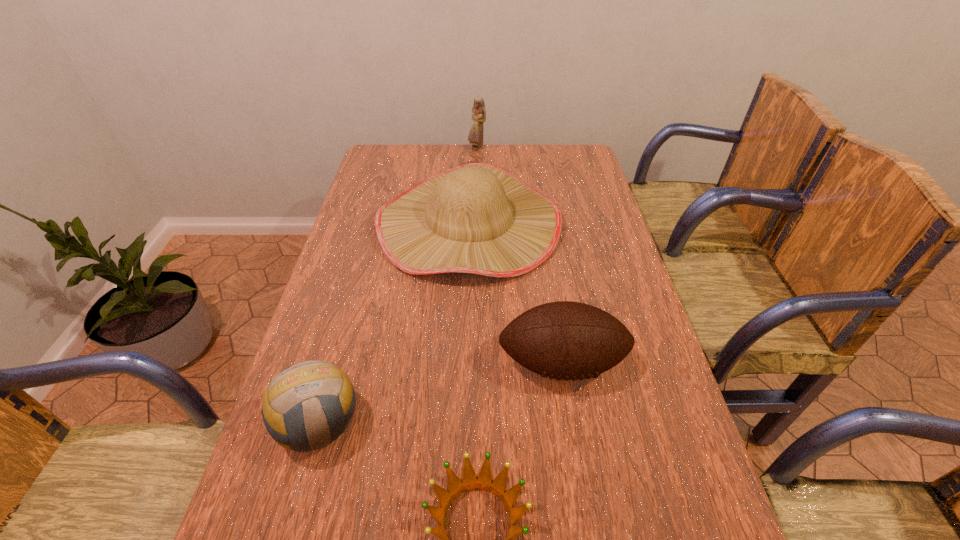
Identify the location of figurine. This screenshot has height=540, width=960. (475, 137).

What are the coordinates of `sunhat` in the screenshot? It's located at (479, 218).

Identify the location of football. (564, 340).

Find the location of `volleyball`. volleyball is located at coordinates (292, 413).

Locate an element on the screen. Image resolution: width=960 pixels, height=540 pixels. free space located on the front-facing side of the farthest object is located at coordinates pos(477,167).

Locate an element on the screen. This screenshot has width=960, height=540. vacant space located 0.060m on the back of the sunhat is located at coordinates (470, 167).

The width and height of the screenshot is (960, 540). Find the location of `free space located on the laces of the football`. free space located on the laces of the football is located at coordinates (572, 431).

You are a GUI agent. You are given a task and a screenshot of the screen. Output one action in this format:
    pyautogui.click(x=<x>, y=<y>)
    Task: Click on the blank space located on the right of the volleyball
    
    Given the screenshot: What is the action you would take?
    (444, 424)

You are a GUI agent. You are given a task and a screenshot of the screen. Output one action in this format:
    pyautogui.click(x=<x>, y=<y>)
    Task: Click on the figurine at the far edge
    This screenshot has height=540, width=960.
    Given the screenshot: What is the action you would take?
    pyautogui.click(x=475, y=137)

At what (x,y) coordinates should I click in order to perform the action: click on sunhat that is at the far edge. Please return your answer as a coordinate pair (x, y). The width and height of the screenshot is (960, 540). Looking at the image, I should click on (479, 218).